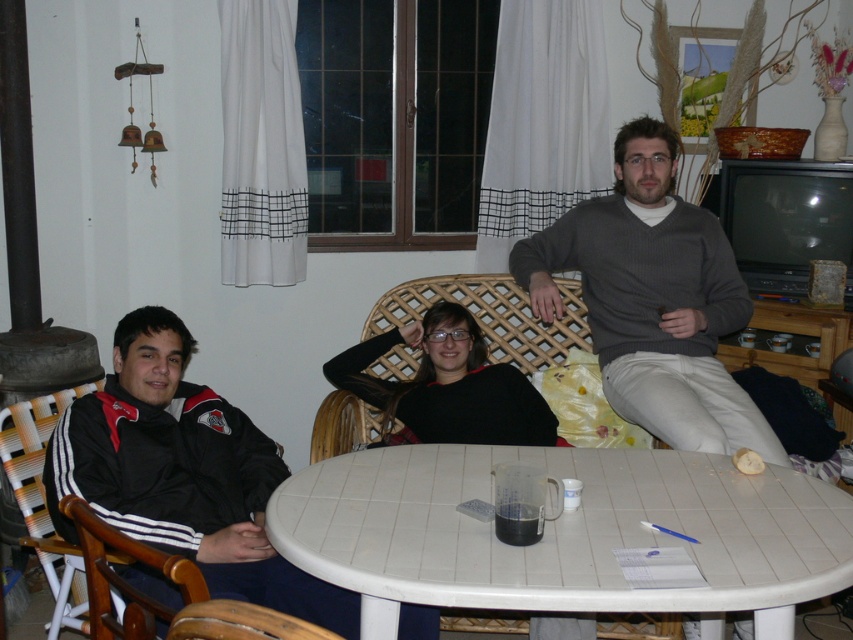
You are a photographer setting up a shoot in this living room. You need to arrange two subjects so that one is above the other. Which subject should you place higher to match the existing arrangement? The options are the black fabric jacket at left and the gray sweater at center.

The gray sweater at center should be placed higher because the black fabric jacket at left is positioned under it in the current setup.

You are standing in the living room and need to find the black fabric jacket at left. According to the coordinates provided, where exactly is it positioned?

The black fabric jacket at left is located at point (183,474).

Based on the scene description, which object is wider between the white tile table at center and the black sweater at center?

The white tile table at center is wider than the black sweater at center according to the description.